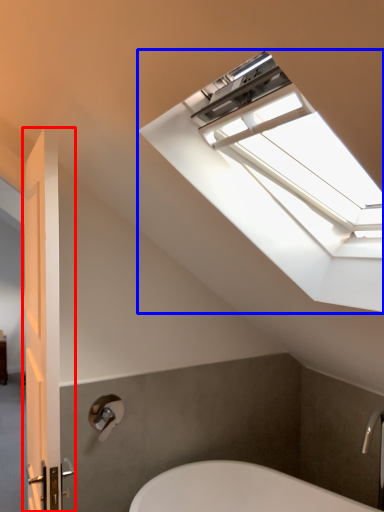
Question: Which object appears farthest to the camera in this image, door (highlighted by a red box) or window (highlighted by a blue box)?

Choices:
 (A) door
 (B) window

Answer: (A)